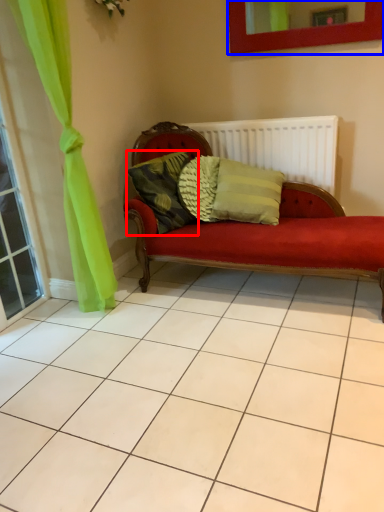
Question: Which of the following is the closest to the observer, pillow (highlighted by a red box) or picture frame (highlighted by a blue box)?

Choices:
 (A) pillow
 (B) picture frame

Answer: (B)